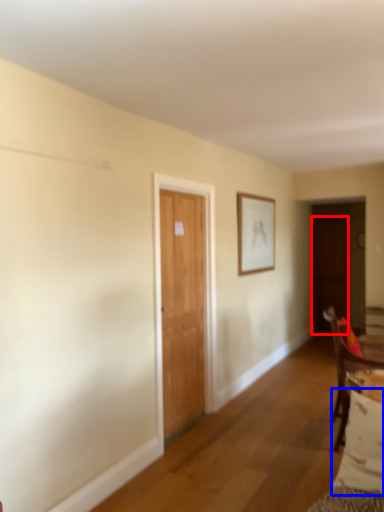
Question: Among these objects, which one is farthest to the camera, door (highlighted by a red box) or pillow (highlighted by a blue box)?

Choices:
 (A) door
 (B) pillow

Answer: (A)